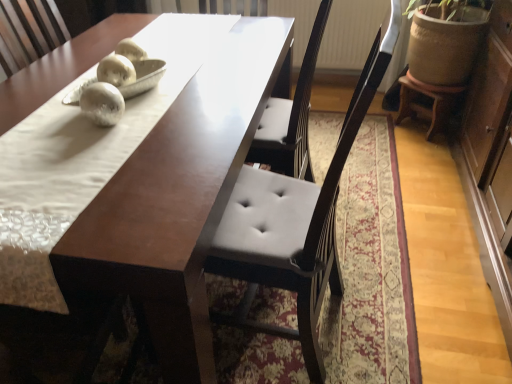
Question: Is wooden stool at right further to camera compared to matte brown table at center?

Choices:
 (A) yes
 (B) no

Answer: (A)

Question: Considering the relative sizes of wooden stool at right and matte brown table at center in the image provided, is wooden stool at right bigger than matte brown table at center?

Choices:
 (A) no
 (B) yes

Answer: (A)

Question: Is wooden stool at right oriented away from matte brown table at center?

Choices:
 (A) no
 (B) yes

Answer: (A)

Question: From a real-world perspective, is wooden stool at right positioned over matte brown table at center based on gravity?

Choices:
 (A) no
 (B) yes

Answer: (A)

Question: Can you confirm if wooden stool at right is smaller than matte brown table at center?

Choices:
 (A) yes
 (B) no

Answer: (A)

Question: Can we say wooden stool at right lies outside matte brown table at center?

Choices:
 (A) no
 (B) yes

Answer: (B)

Question: Is matte brown table at center oriented towards white fabric mat at center?

Choices:
 (A) no
 (B) yes

Answer: (A)

Question: Is matte brown table at center positioned with its back to white fabric mat at center?

Choices:
 (A) no
 (B) yes

Answer: (A)

Question: From the image's perspective, does matte brown table at center appear higher than white fabric mat at center?

Choices:
 (A) no
 (B) yes

Answer: (B)

Question: From a real-world perspective, is matte brown table at center positioned over white fabric mat at center based on gravity?

Choices:
 (A) yes
 (B) no

Answer: (B)

Question: From the image's perspective, is matte brown table at center beneath white fabric mat at center?

Choices:
 (A) yes
 (B) no

Answer: (B)

Question: Is matte brown table at center not near white fabric mat at center?

Choices:
 (A) no
 (B) yes

Answer: (A)

Question: Does matte brown table at center have a greater height compared to wooden stool at right?

Choices:
 (A) no
 (B) yes

Answer: (B)